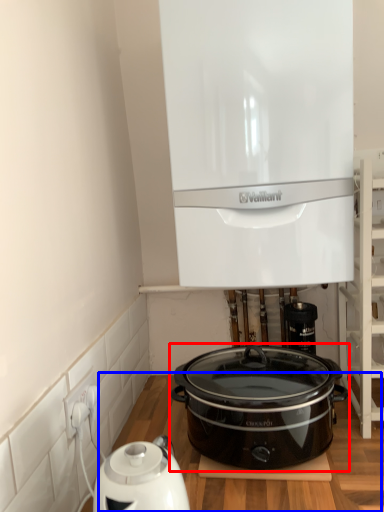
Question: Which object appears closest to the camera in this image, slow cooker (highlighted by a red box) or table (highlighted by a blue box)?

Choices:
 (A) slow cooker
 (B) table

Answer: (B)